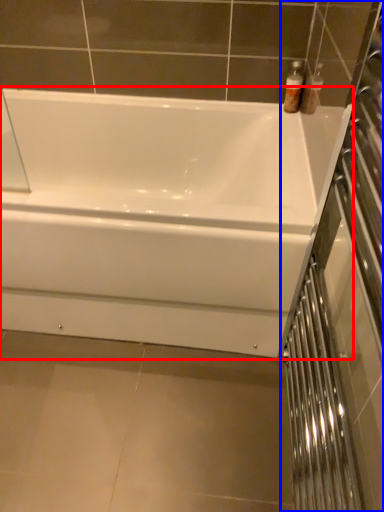
Question: Among these objects, which one is farthest to the camera, bathtub (highlighted by a red box) or screen door (highlighted by a blue box)?

Choices:
 (A) bathtub
 (B) screen door

Answer: (A)